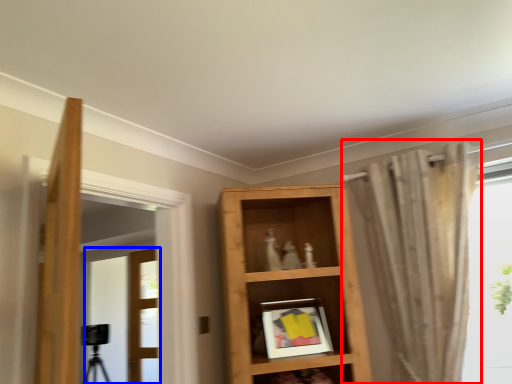
Question: Which object is closer to the camera taking this photo, curtain (highlighted by a red box) or door (highlighted by a blue box)?

Choices:
 (A) curtain
 (B) door

Answer: (A)